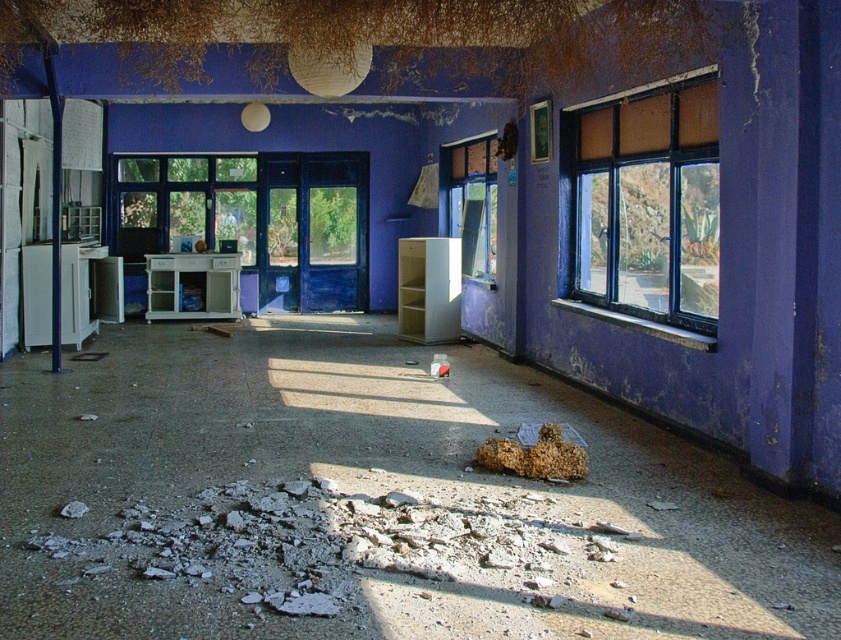
Question: Is matte glass window at right to the right of crumbly brown bread at lower center from the viewer's perspective?

Choices:
 (A) yes
 (B) no

Answer: (A)

Question: Which object appears farthest from the camera in this image?

Choices:
 (A) crumbly brown bread at lower center
 (B) matte glass window at right

Answer: (B)

Question: Which object appears closest to the camera in this image?

Choices:
 (A) crumbly brown bread at lower center
 (B) matte glass window at right
 (C) transparent glass window at center

Answer: (A)

Question: Can you confirm if matte glass window at right is wider than transparent glass window at center?

Choices:
 (A) yes
 (B) no

Answer: (A)

Question: Is transparent glass window at center wider than crumbly brown bread at lower center?

Choices:
 (A) no
 (B) yes

Answer: (B)

Question: Among these objects, which one is farthest from the camera?

Choices:
 (A) matte glass window at right
 (B) transparent glass window at center
 (C) crumbly brown bread at lower center

Answer: (B)